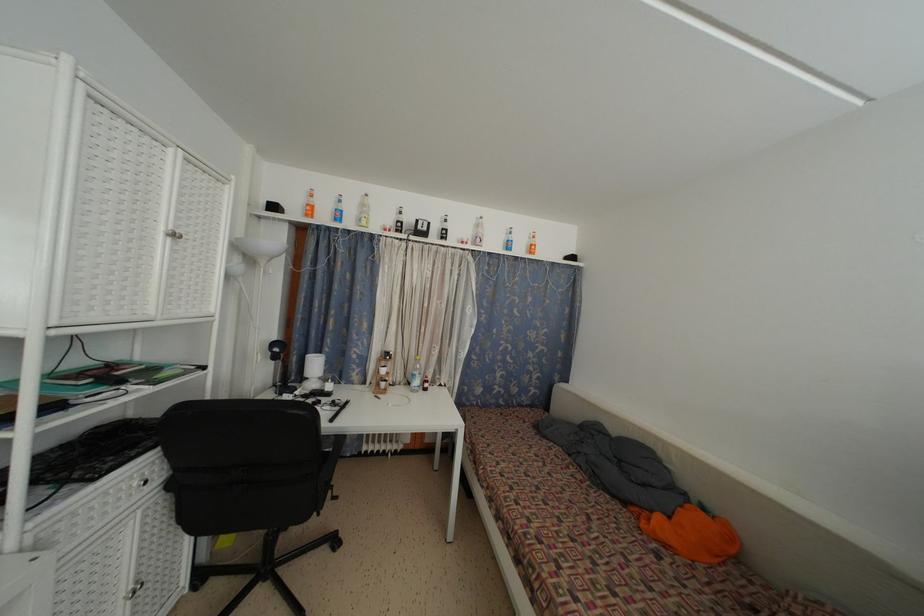
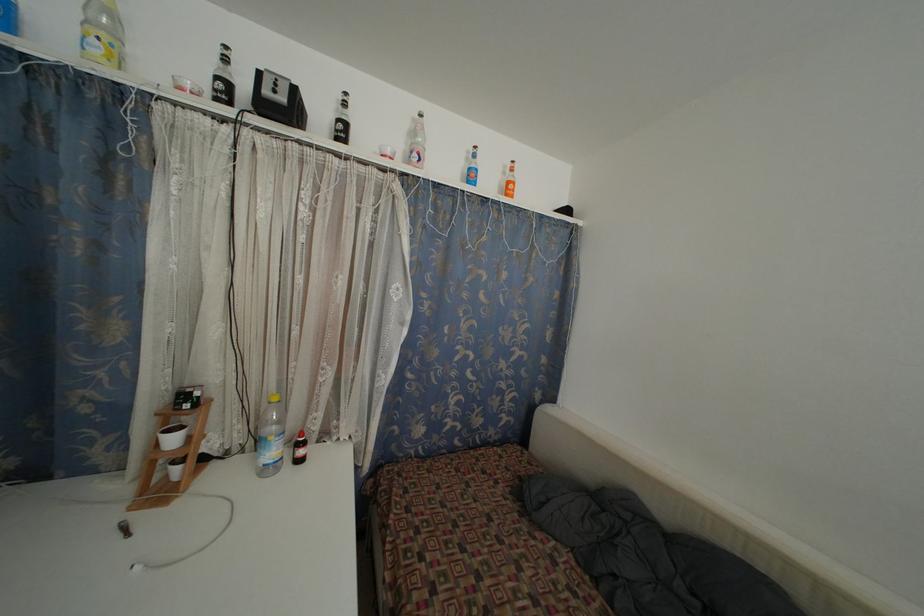
Question: In a continuous first-person perspective shot, in which direction is the camera moving?

Choices:
 (A) Left
 (B) Right
 (C) Forward
 (D) Backward

Answer: (C)